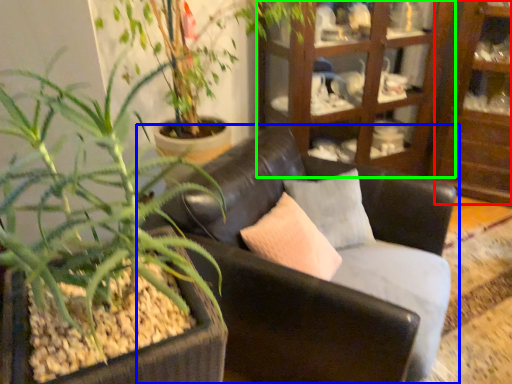
Question: Which is farther away from shelf (highlighted by a red box)? chair (highlighted by a blue box) or cabinetry (highlighted by a green box)?

Choices:
 (A) chair
 (B) cabinetry

Answer: (A)